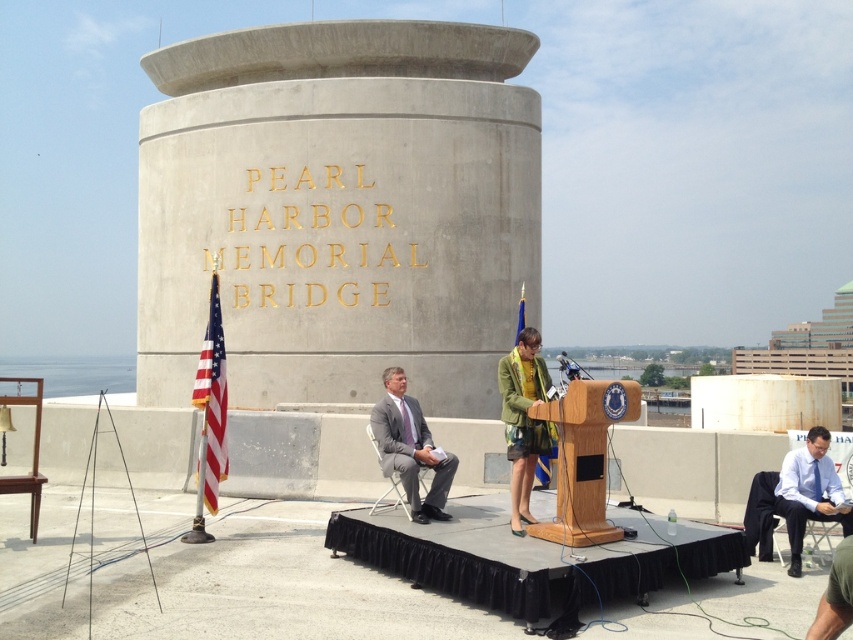
Question: Which point appears closest to the camera in this image?

Choices:
 (A) (454, 218)
 (B) (405, 486)

Answer: (B)

Question: Which of these objects is positioned closest to the wooden podium at center?

Choices:
 (A) gray matte suit at center
 (B) concrete gold lettering at center

Answer: (A)

Question: Can you confirm if wooden podium at center is positioned to the right of blue shirt at right?

Choices:
 (A) no
 (B) yes

Answer: (A)

Question: Which point is closer to the camera taking this photo?

Choices:
 (A) click(524, 304)
 (B) click(535, 440)
 (C) click(467, 176)
 (D) click(418, 460)

Answer: (B)

Question: Does gray matte suit at center come in front of blue fabric flag at center?

Choices:
 (A) yes
 (B) no

Answer: (A)

Question: Is green fabric jacket at center to the left of blue shirt at right from the viewer's perspective?

Choices:
 (A) no
 (B) yes

Answer: (B)